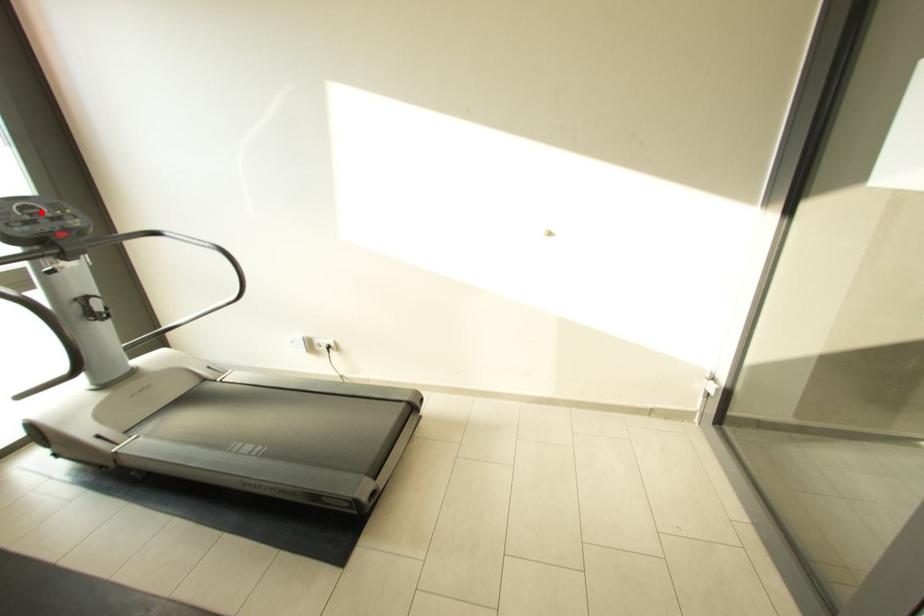
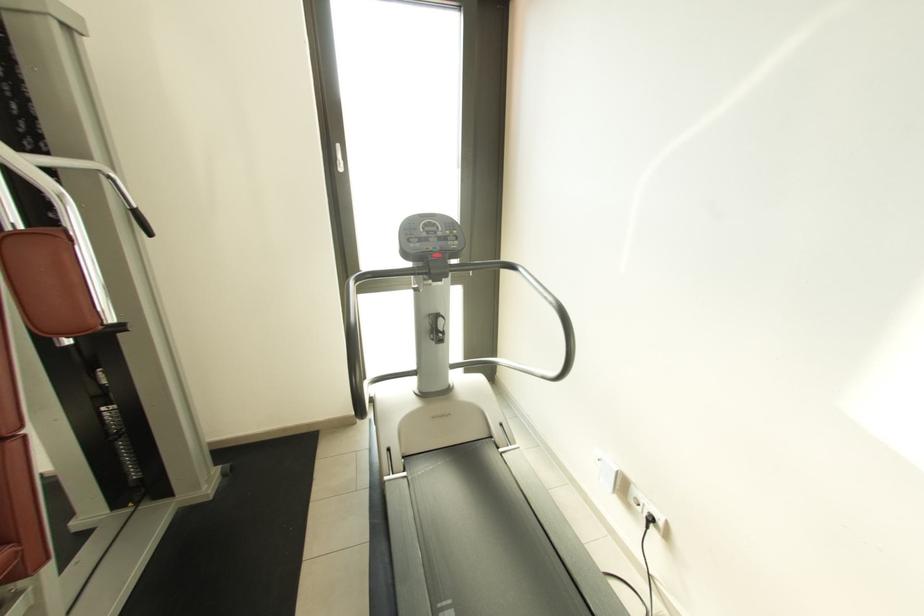
Locate, in the second image, the point that corresponds to the highlighted location in the first image.

(439, 230)